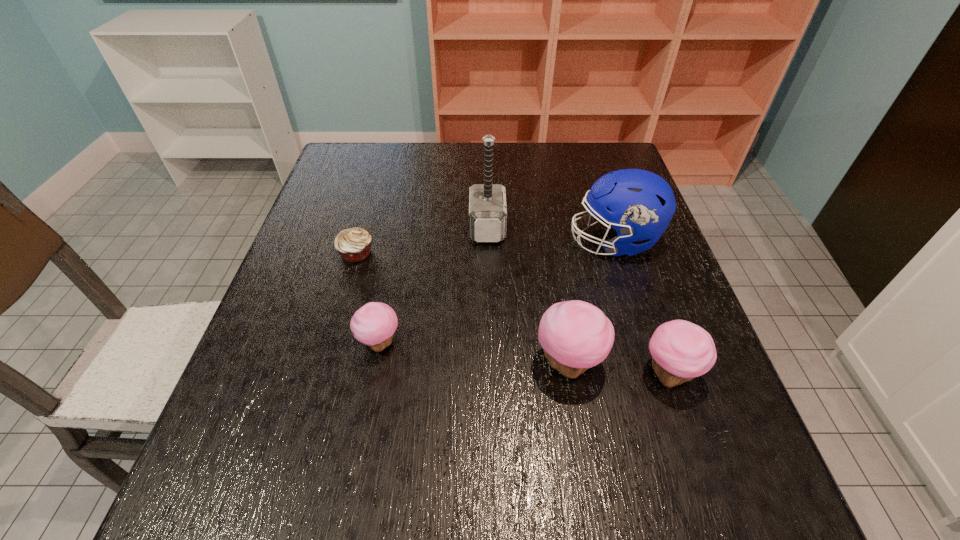
To achieve uniform spacing by inserting another cupcake among them, please point to a free space for this new cupcake. Please provide its 2D coordinates. Your answer should be formatted as a tuple, i.e. [(x, y)], where the tuple contains the x and y coordinates of a point satisfying the conditions above.

[(472, 353)]